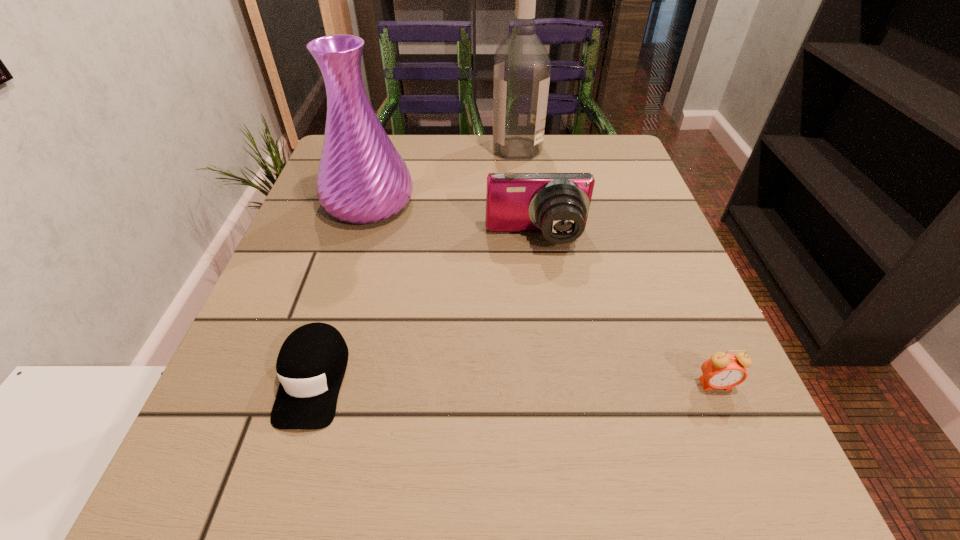
Identify the location of the tallest object. This screenshot has width=960, height=540. (522, 68).

This screenshot has height=540, width=960. Find the location of `the farthest object`. the farthest object is located at coordinates (522, 68).

This screenshot has width=960, height=540. Identify the location of the fourth shortest object. (362, 178).

What are the coordinates of `camera` in the screenshot? It's located at (557, 204).

In order to click on alarm clock in this screenshot , I will do `click(722, 371)`.

Find the location of a particular element. The width and height of the screenshot is (960, 540). the rightmost object is located at coordinates (722, 371).

Image resolution: width=960 pixels, height=540 pixels. I want to click on the shortest object, so click(311, 364).

Identify the location of free spot located on the front-facing side of the tallest object. (372, 148).

Where is `free region located on the front-facing side of the tallest object`? Image resolution: width=960 pixels, height=540 pixels. free region located on the front-facing side of the tallest object is located at coordinates (383, 148).

Find the location of a particular element. This screenshot has height=540, width=960. vacant space located on the front-facing side of the tallest object is located at coordinates (340, 148).